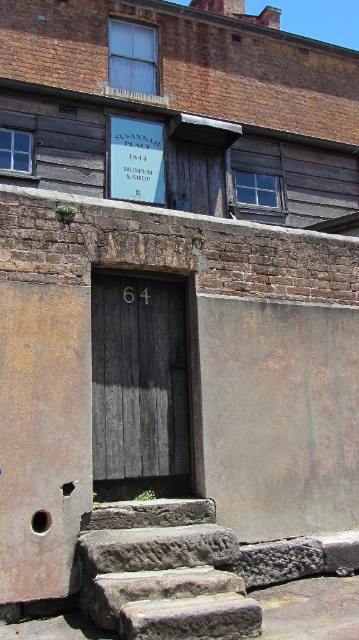
You are standing in front of Susannah Place 1844 Museum and Shop. You see two points marked on the building. The first point is at coordinates point [229,572] and the second point is at point [147,346]. Which point is closer to you?

Point [229,572] is in front of point [147,346], so the first point is closer to you.

You are standing at the entrance of Susannah Place 1844 Museum and see the rusty stone stairs at lower left and the weathered wood door at center. Which object is closer to you?

The rusty stone stairs at lower left are closer to you because they are in front of the weathered wood door at center.